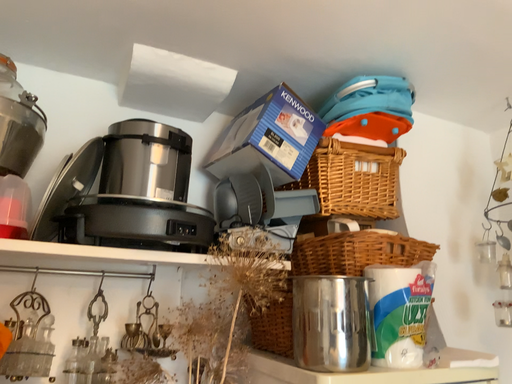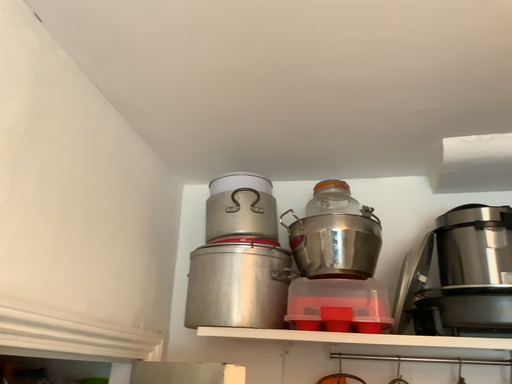
Question: Which way did the camera rotate in the video?

Choices:
 (A) rotated right
 (B) rotated left

Answer: (B)